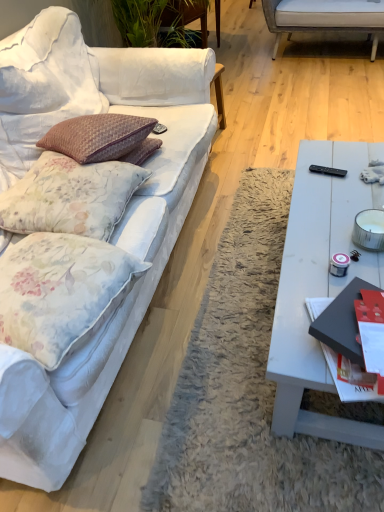
Question: Is red glossy magazine at right at the right side of floral fabric pillow at left, which ranks as the 2th pillow in bottom-to-top order?

Choices:
 (A) yes
 (B) no

Answer: (A)

Question: From the image's perspective, is red glossy magazine at right beneath floral fabric pillow at left, acting as the first pillow starting from the top?

Choices:
 (A) no
 (B) yes

Answer: (B)

Question: Is red glossy magazine at right oriented towards floral fabric pillow at left, which ranks as the 2th pillow in bottom-to-top order?

Choices:
 (A) no
 (B) yes

Answer: (A)

Question: Is red glossy magazine at right placed right next to floral fabric pillow at left, which ranks as the 2th pillow in bottom-to-top order?

Choices:
 (A) no
 (B) yes

Answer: (A)

Question: Is red glossy magazine at right shorter than floral fabric pillow at left, acting as the first pillow starting from the top?

Choices:
 (A) no
 (B) yes

Answer: (B)

Question: Is the depth of red glossy magazine at right less than that of floral fabric pillow at left, which ranks as the 2th pillow in bottom-to-top order?

Choices:
 (A) yes
 (B) no

Answer: (A)

Question: Does floral fabric pillow at left, which ranks as the 2th pillow in bottom-to-top order, turn towards floral fabric pillow at left, which is the first pillow from bottom to top?

Choices:
 (A) no
 (B) yes

Answer: (A)

Question: Can you confirm if floral fabric pillow at left, acting as the first pillow starting from the top, is positioned to the left of floral fabric pillow at left, which is the first pillow from bottom to top?

Choices:
 (A) no
 (B) yes

Answer: (B)

Question: From a real-world perspective, does floral fabric pillow at left, acting as the first pillow starting from the top, stand above floral fabric pillow at left, acting as the second pillow starting from the top?

Choices:
 (A) yes
 (B) no

Answer: (A)

Question: From the image's perspective, is floral fabric pillow at left, acting as the first pillow starting from the top, under floral fabric pillow at left, acting as the second pillow starting from the top?

Choices:
 (A) no
 (B) yes

Answer: (A)

Question: Considering the relative sizes of floral fabric pillow at left, which ranks as the 2th pillow in bottom-to-top order, and floral fabric pillow at left, acting as the second pillow starting from the top, in the image provided, is floral fabric pillow at left, which ranks as the 2th pillow in bottom-to-top order, shorter than floral fabric pillow at left, acting as the second pillow starting from the top,?

Choices:
 (A) yes
 (B) no

Answer: (A)

Question: From a real-world perspective, is floral fabric pillow at left, which ranks as the 2th pillow in bottom-to-top order, physically below floral fabric pillow at left, which is the first pillow from bottom to top?

Choices:
 (A) no
 (B) yes

Answer: (A)

Question: Is black plastic remote control at right turned away from white fabric couch at left?

Choices:
 (A) no
 (B) yes

Answer: (B)